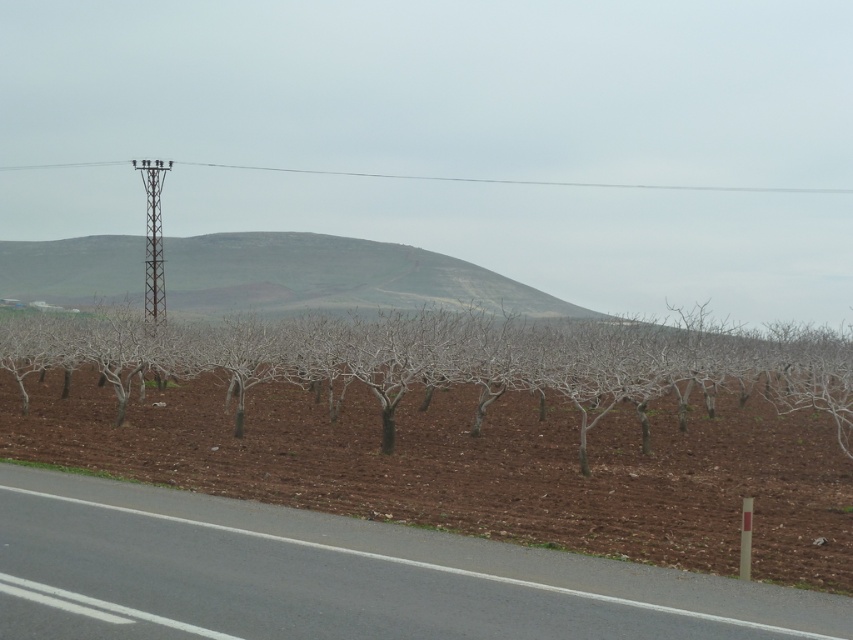
You are standing at the edge of a rural field looking at two points marked in the image. Which point, point [601,332] or point [453,180], is closer to you?

Point [601,332] is closer to the viewer than point [453,180].

You are standing at the edge of the rural landscape looking towards the row of trees. There are two points marked in the image. Which point, point (117, 369) or point (244, 259), appears closer to you?

Point (117, 369) is closer to the camera than point (244, 259), so it appears closer to you.